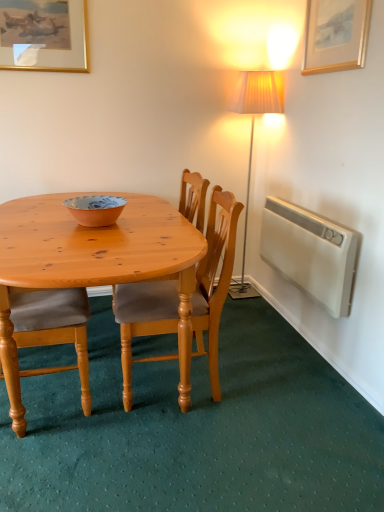
You are a GUI agent. You are given a task and a screenshot of the screen. Output one action in this format:
    pyautogui.click(x=<x>, y=<y>)
    Task: Click on the blank space above white plastic radiator at right (from a real-world perspective)
    The width and height of the screenshot is (384, 512).
    Given the screenshot: What is the action you would take?
    pyautogui.click(x=315, y=208)